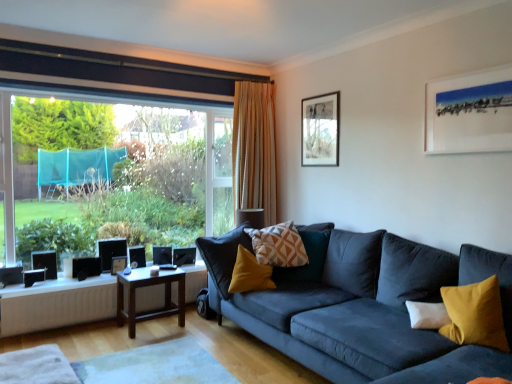
Identify the location of blank space situated above matte white picture frame at upper right, the first picture frame positioned from the front (from a real-world perspective). (470, 72).